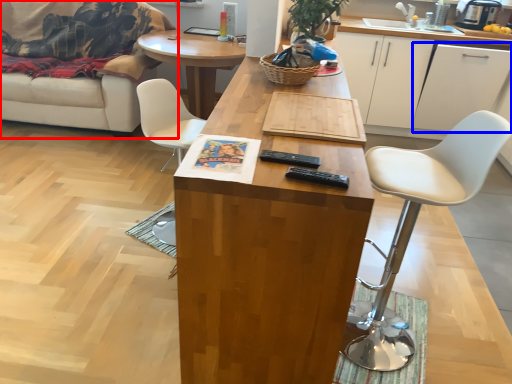
Question: Which object is further to the camera taking this photo, studio couch (highlighted by a red box) or cabinetry (highlighted by a blue box)?

Choices:
 (A) studio couch
 (B) cabinetry

Answer: (B)